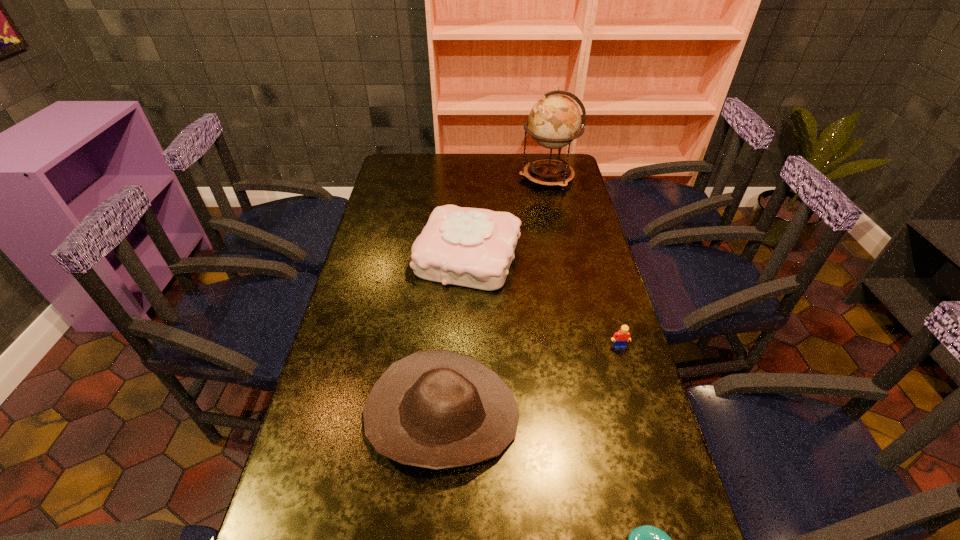
At what (x,y) coordinates should I click in order to perform the action: click on vacant space at the far left corner of the desktop. Please return your answer as a coordinate pair (x, y). This screenshot has height=540, width=960. Looking at the image, I should click on (410, 164).

This screenshot has width=960, height=540. In order to click on unoccupied area between the Lego and the second nearest object in this screenshot , I will do `click(531, 381)`.

Identify the location of blank region between the second farthest object and the second shortest object. (543, 301).

Where is `vacant area that lies between the second farthest object and the fourth farthest object`? The width and height of the screenshot is (960, 540). vacant area that lies between the second farthest object and the fourth farthest object is located at coordinates (455, 336).

Select which object is the closest to the shortest object. Please provide its 2D coordinates. Your answer should be formatted as a tuple, i.e. [(x, y)], where the tuple contains the x and y coordinates of a point satisfying the conditions above.

[(436, 409)]

Select which object appears as the second closest to the cowboy hat. Please provide its 2D coordinates. Your answer should be formatted as a tuple, i.e. [(x, y)], where the tuple contains the x and y coordinates of a point satisfying the conditions above.

[(471, 247)]